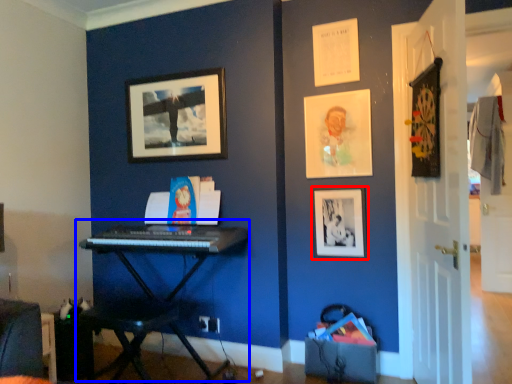
Question: Among these objects, which one is nearest to the camera, picture frame (highlighted by a red box) or piano (highlighted by a blue box)?

Choices:
 (A) picture frame
 (B) piano

Answer: (B)